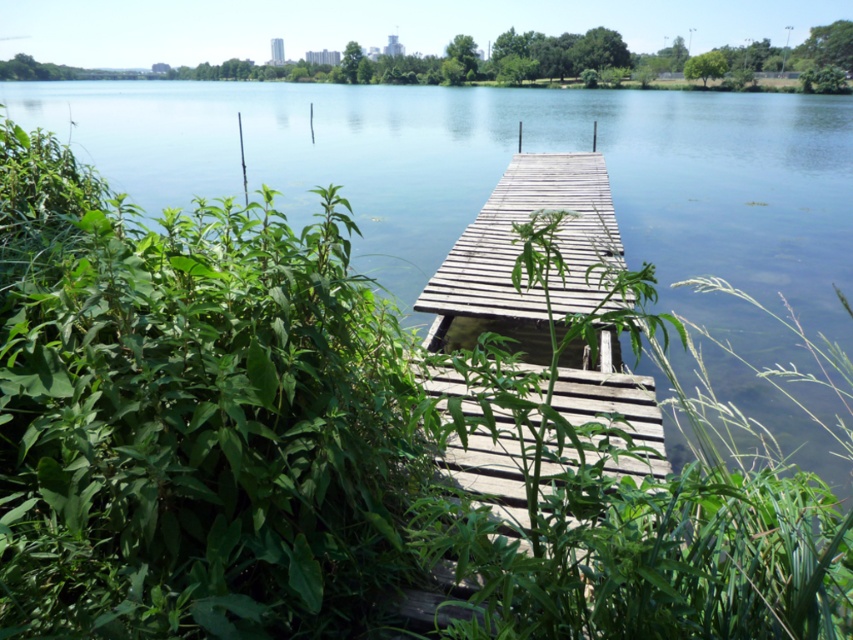
Between green leafy plant at center and green leafy plants at upper center, which one is positioned higher?

green leafy plants at upper center is higher up.

Looking at this image, can you confirm if green leafy plant at center is shorter than green leafy plants at upper center?

Yes, green leafy plant at center is shorter than green leafy plants at upper center.

This screenshot has width=853, height=640. Describe the element at coordinates (627, 518) in the screenshot. I see `green leafy plant at center` at that location.

What are the coordinates of `green leafy plant at center` in the screenshot? It's located at (627, 518).